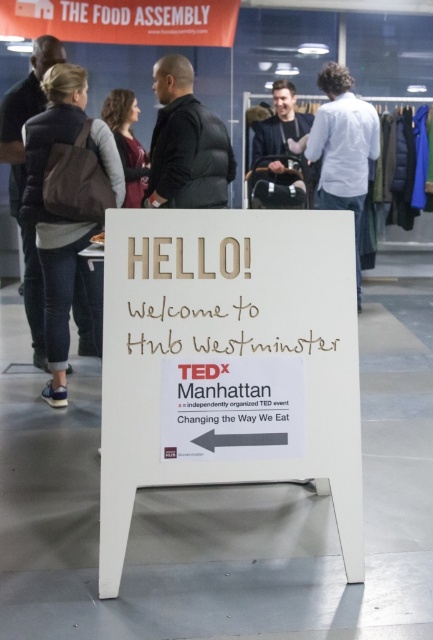
You are at the event and want to borrow a jacket from the two available. The denim jacket at left is to the left of the black puffer jacket at center. Which jacket is closer to you if you are standing in front of the sign?

The denim jacket at left is closer to you since it is positioned to the left of the black puffer jacket at center, meaning it is nearer when standing in front of the sign.